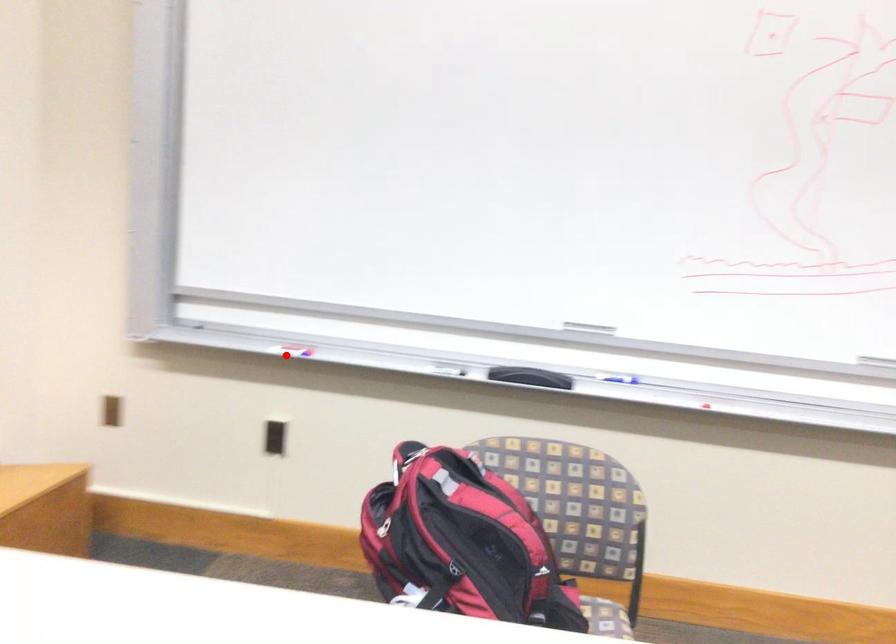
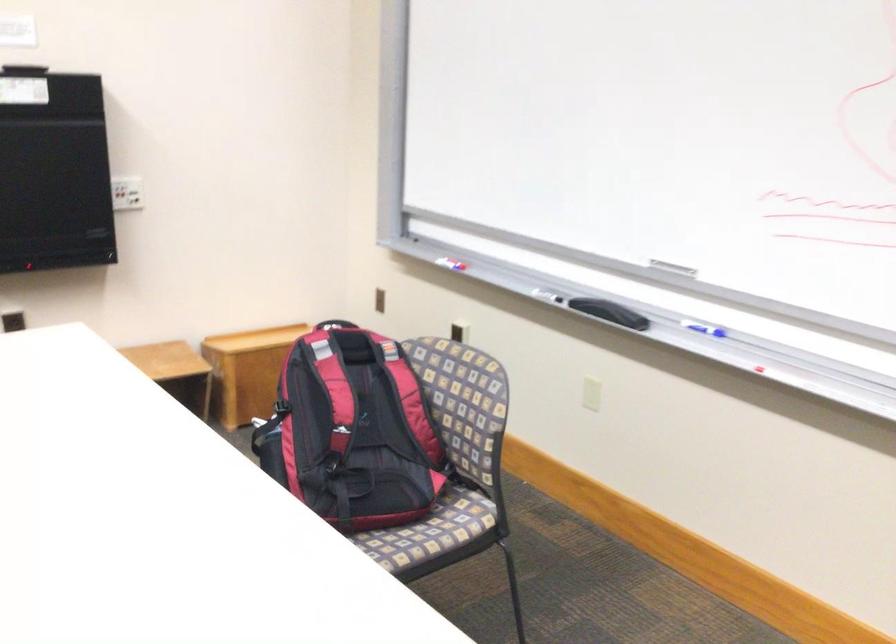
Find the pixel in the second image that matches the highlighted location in the first image.

(451, 261)